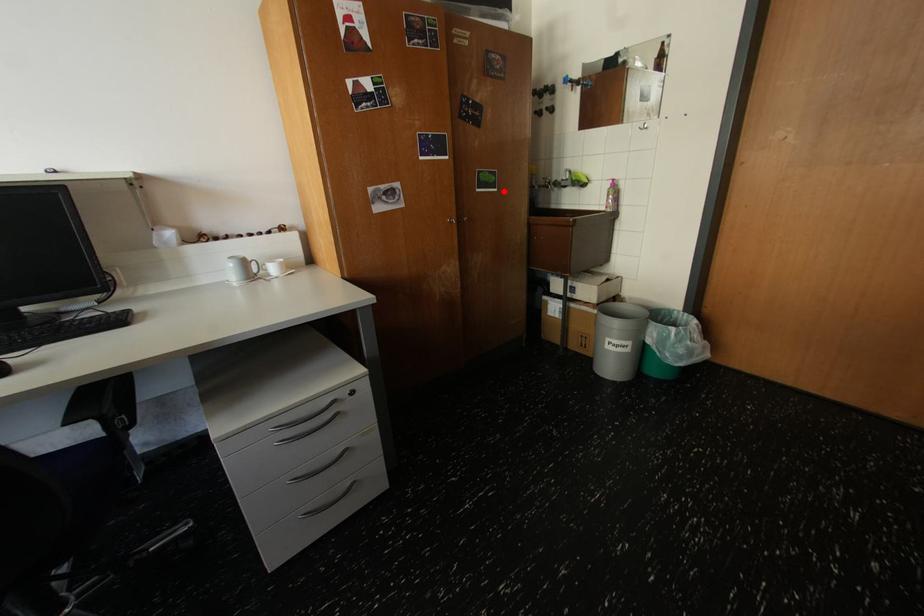
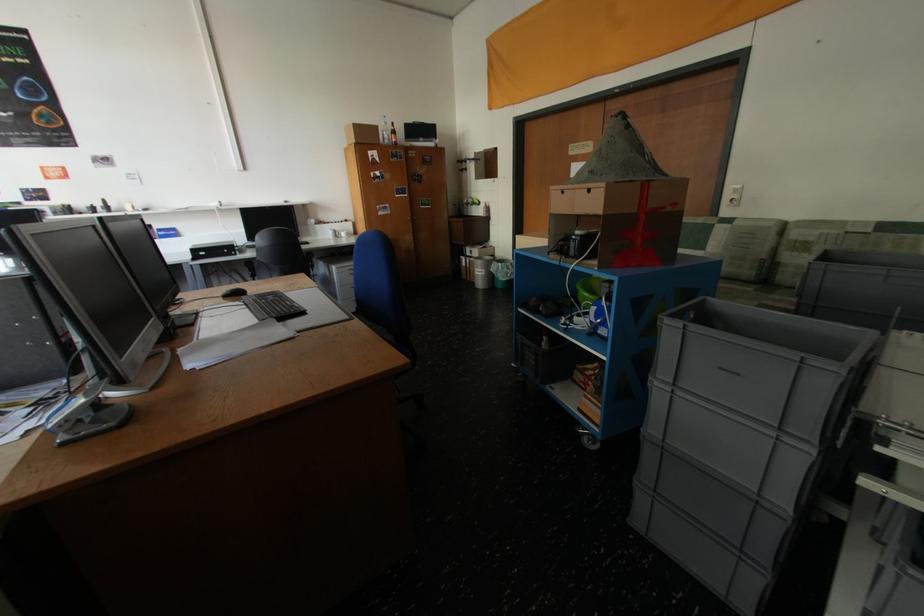
Find the pixel in the second image that matches the highlighted location in the first image.

(439, 208)